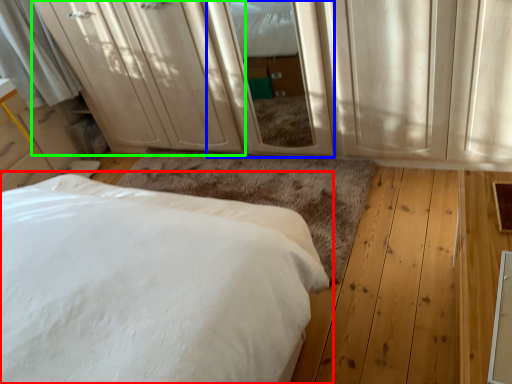
Question: Considering the real-world distances, which object is farthest from bed (highlighted by a red box)? screen door (highlighted by a blue box) or dresser (highlighted by a green box)?

Choices:
 (A) screen door
 (B) dresser

Answer: (B)